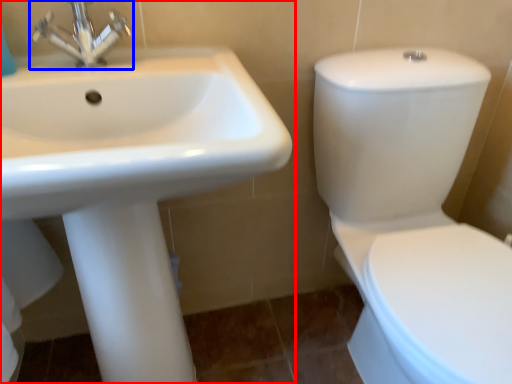
Question: Which object is closer to the camera taking this photo, sink (highlighted by a red box) or tap (highlighted by a blue box)?

Choices:
 (A) sink
 (B) tap

Answer: (A)